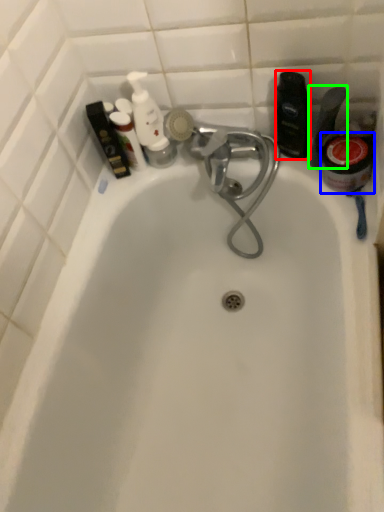
Question: Considering the real-world distances, which object is closest to toiletry (highlighted by a red box)? mouthwash (highlighted by a blue box) or toiletry (highlighted by a green box).

Choices:
 (A) mouthwash
 (B) toiletry

Answer: (B)